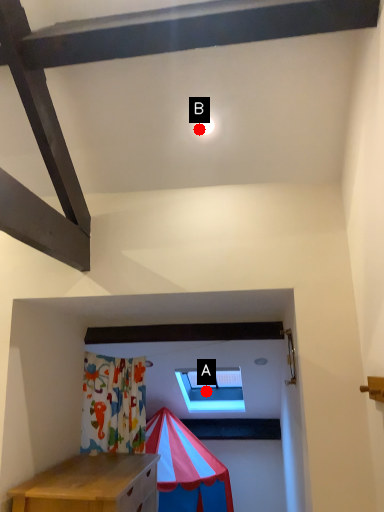
Question: Two points are circled on the image, labeled by A and B beside each circle. Among these points, which one is farthest from the camera?

Choices:
 (A) A is further
 (B) B is further

Answer: (A)